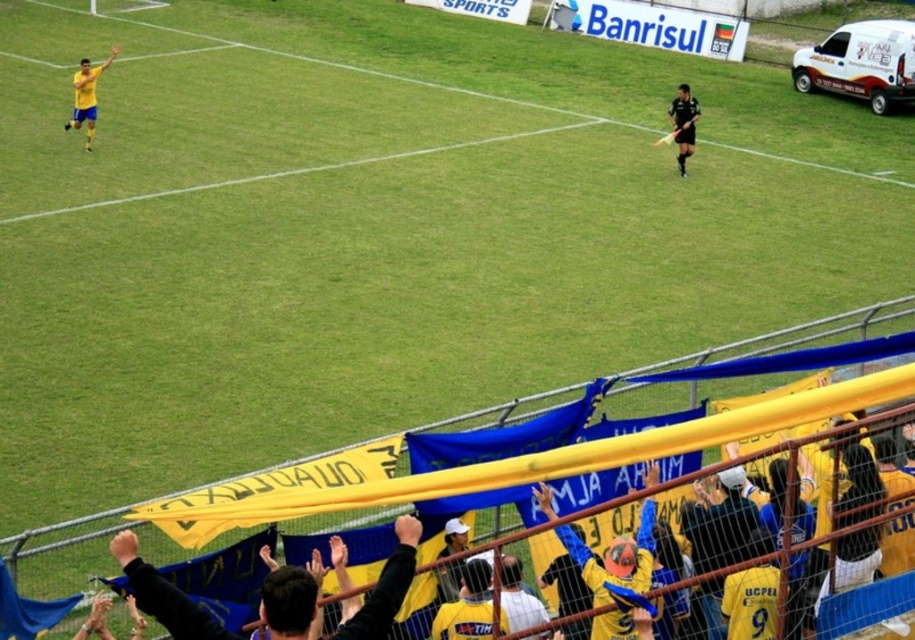
You are a photographer standing at the edge of the soccer field. You want to take a photo that includes both the matte yellow shorts at left and the black matte uniform at center. Which player should you focus on first to ensure both are in frame?

The matte yellow shorts at left is much taller than the black matte uniform at center, so you should focus on the matte yellow shorts at left first to ensure both are in frame.

You are a soccer player positioned at point A, which is at coordinates point A at (77, 83), and you need to pass the ball to your teammate at point B at (698, 109). Considering the positions of the two points, which direction should you kick the ball to ensure it reaches your teammate?

You should kick the ball towards the direction of point B at (698, 109), which is further away from the camera compared to point A at (77, 83). Since point B is behind point A from your perspective, you need to aim the ball in that direction to reach your teammate.

You are a soccer referee standing at the center of the field. You need to quickly determine if the players are within the required 10 meters distance for a throw in. Are the matte yellow shorts at left and the black matte uniform at center within the 10 meters distance?

The matte yellow shorts at left and the black matte uniform at center are 8.55 meters apart from each other, so they are within the required 10 meters distance for a throw in.